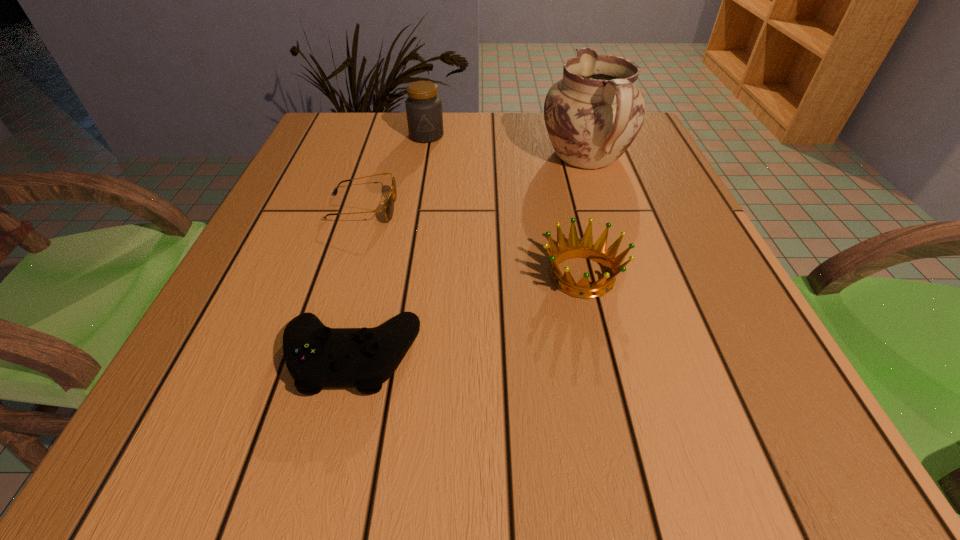
Find the location of a particular element. Image resolution: width=960 pixels, height=540 pixels. free location that satisfies the following two spatial constraints: 1. on the lenses of the third shortest object; 2. on the right side of the shortest object is located at coordinates (341, 276).

Identify the location of vacant position in the image that satisfies the following two spatial constraints: 1. on the surface of the jar near the warning symbol; 2. on the lenses of the sunglasses. (414, 208).

This screenshot has height=540, width=960. What are the coordinates of `free point that satisfies the following two spatial constraints: 1. on the surface of the jar near the warning symbol; 2. on the left side of the third shortest object` in the screenshot? It's located at (401, 276).

The width and height of the screenshot is (960, 540). Identify the location of vacant space that satisfies the following two spatial constraints: 1. on the surface of the jar near the warning symbol; 2. on the lenses of the sunglasses. (414, 208).